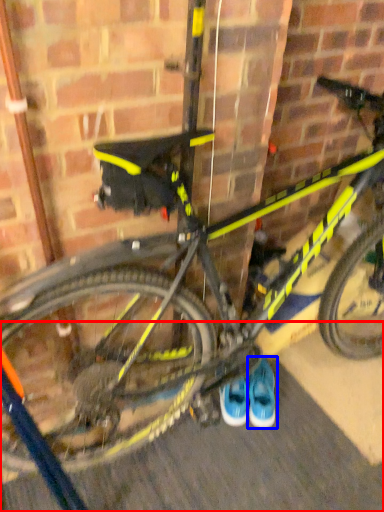
Question: Which object is closer to the camera taking this photo, pavement (highlighted by a red box) or footwear (highlighted by a blue box)?

Choices:
 (A) pavement
 (B) footwear

Answer: (A)